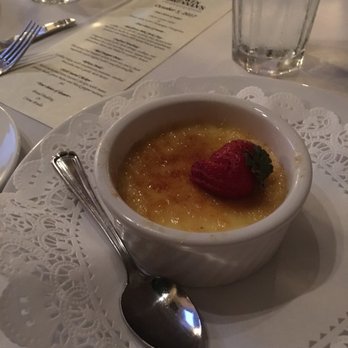
This screenshot has width=348, height=348. What are the coordinates of `dish` in the screenshot? It's located at (238, 258).